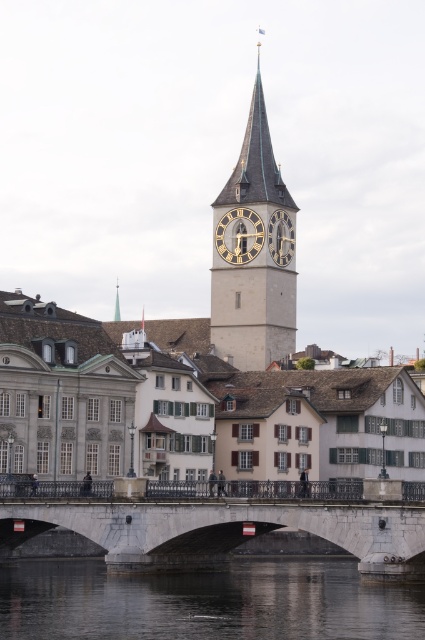
You are a tourist standing in the middle of the white stone bridge at center and want to take a photo of the smooth gray stone clock tower at center. Which direction should you face to ensure the clock tower is in the frame?

You should face to the right to capture the smooth gray stone clock tower at center in your photo since the white stone bridge at center is positioned to its left.